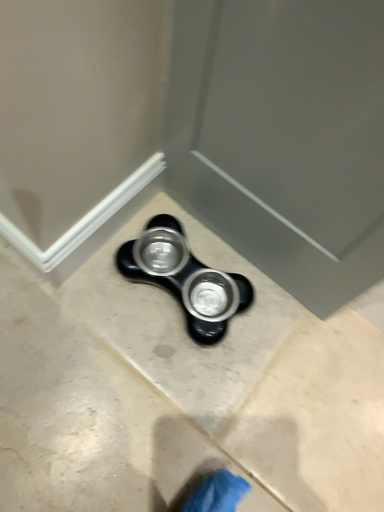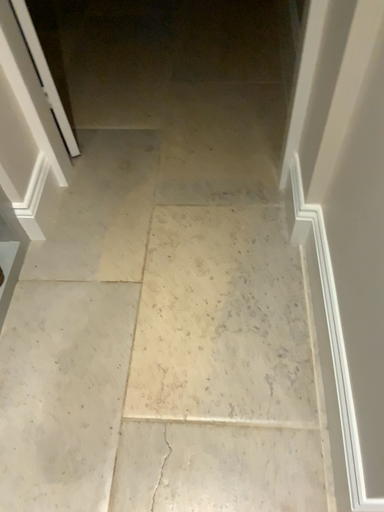
Question: Which way did the camera rotate in the video?

Choices:
 (A) rotated left
 (B) rotated right

Answer: (A)